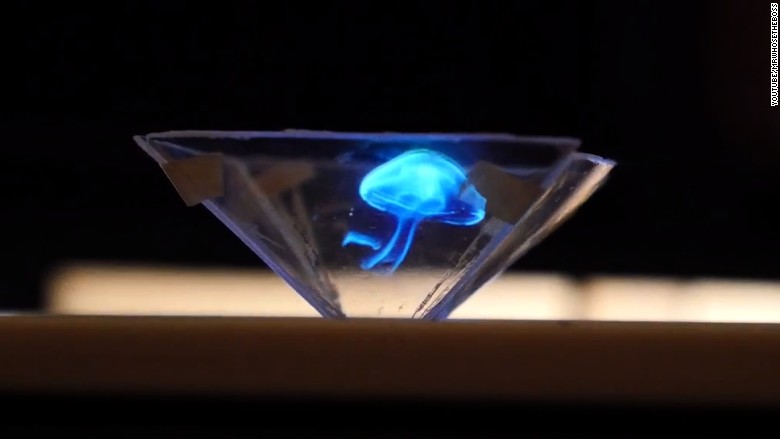
The image size is (780, 439). What are the coordinates of `glass` in the screenshot? It's located at (548, 208), (275, 211).